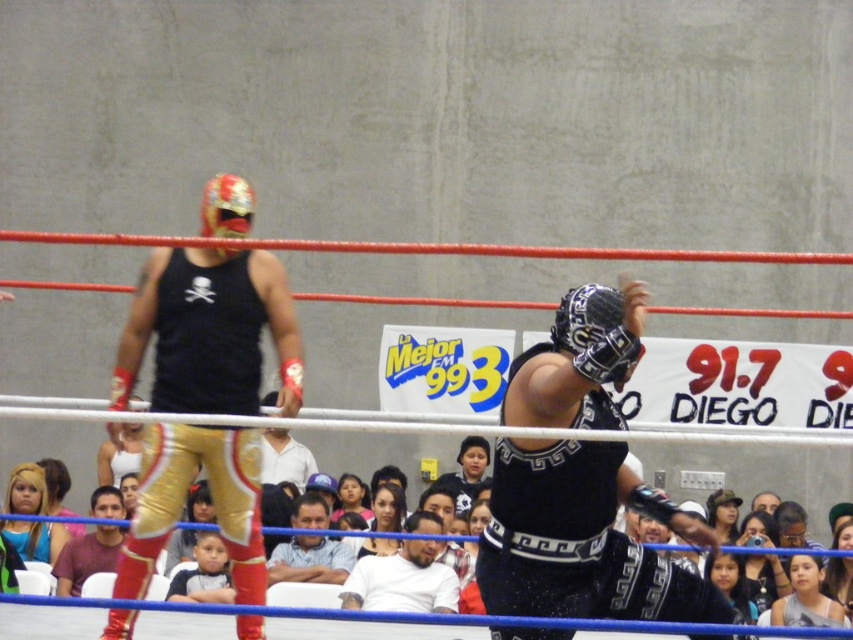
Question: Can you confirm if metallic gold pants at left is positioned to the right of white matte shirt at center?

Choices:
 (A) no
 (B) yes

Answer: (A)

Question: Is metallic gold pants at left above blue striped shirt at center?

Choices:
 (A) yes
 (B) no

Answer: (A)

Question: Can you confirm if white matte shirt at center is positioned to the left of blue striped shirt at center?

Choices:
 (A) yes
 (B) no

Answer: (B)

Question: Which object appears closest to the camera in this image?

Choices:
 (A) black satin mask at center
 (B) blue striped shirt at center
 (C) metallic gold pants at left
 (D) white matte shirt at center

Answer: (A)

Question: Which of these objects is positioned closest to the black satin mask at center?

Choices:
 (A) blue striped shirt at center
 (B) metallic gold pants at left

Answer: (B)

Question: Considering the real-world distances, which object is farthest from the blue striped shirt at center?

Choices:
 (A) white matte shirt at center
 (B) black satin mask at center
 (C) metallic gold pants at left

Answer: (B)